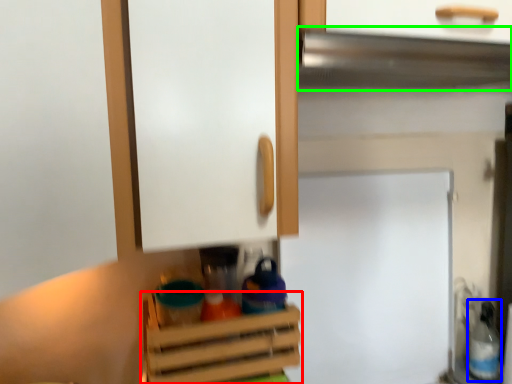
Question: Considering the real-world distances, which object is farthest from cabinetry (highlighted by a red box)? bottle (highlighted by a blue box) or exhaust hood (highlighted by a green box)?

Choices:
 (A) bottle
 (B) exhaust hood

Answer: (A)